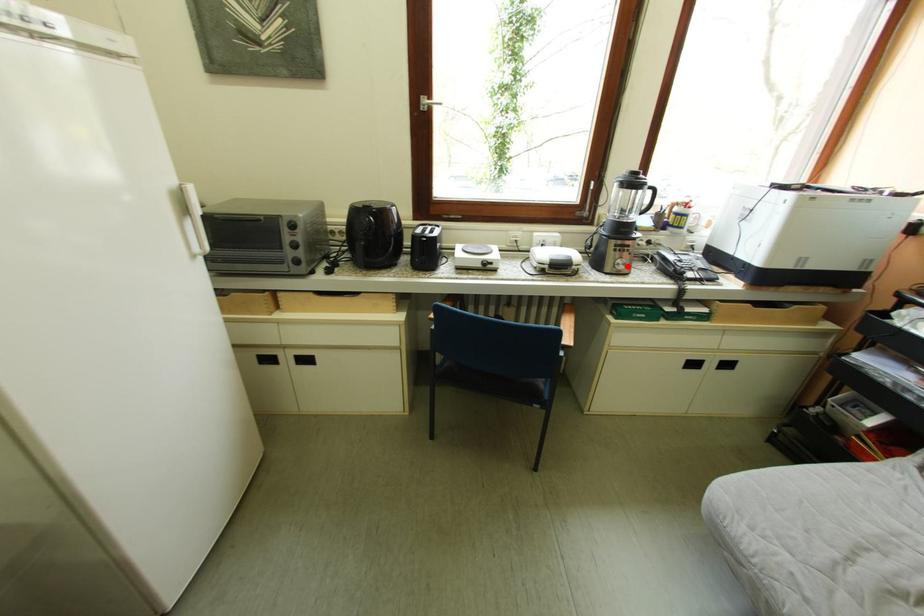
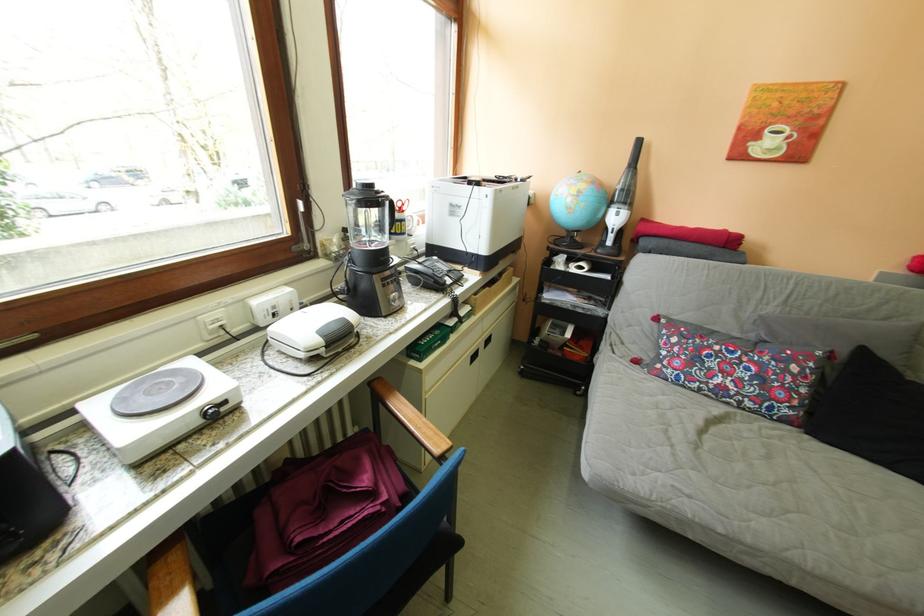
Question: I am providing you with two images of the same scene from different viewpoints. In image1, a red point is highlighted. Considering the same 3D point in image2, which of the following is correct?

Choices:
 (A) It is closer
 (B) It is farther

Answer: (A)